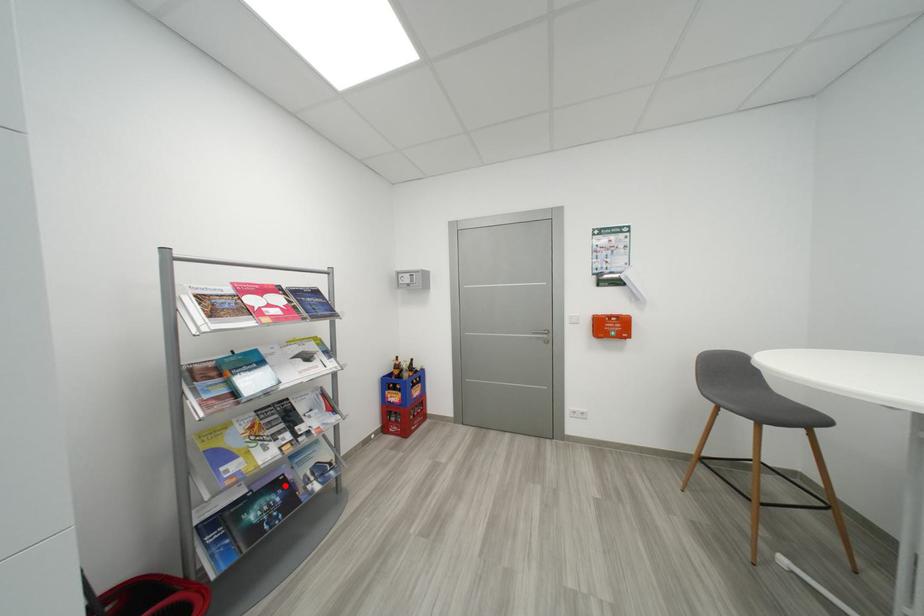
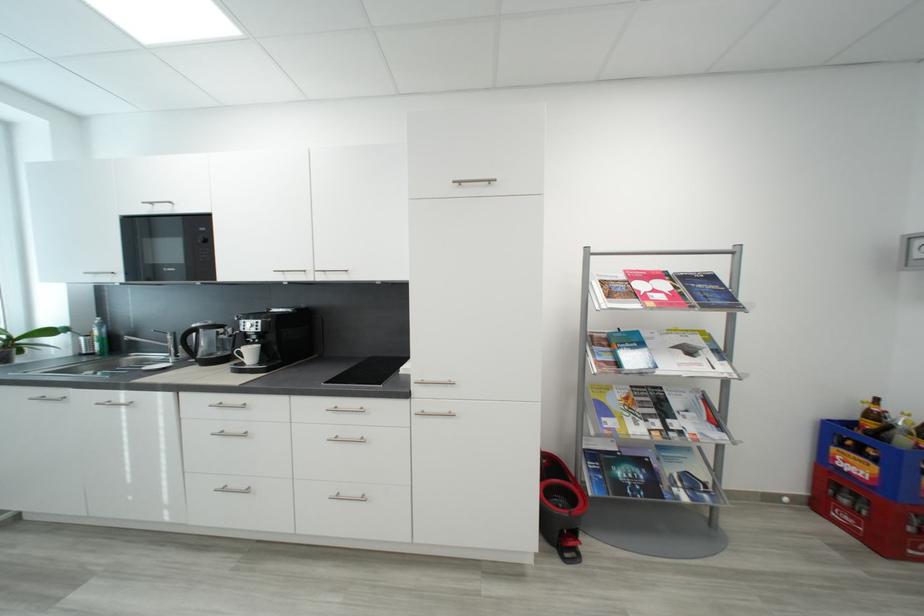
The point at the highlighted location is marked in the first image. Where is the corresponding point in the second image?

(650, 464)